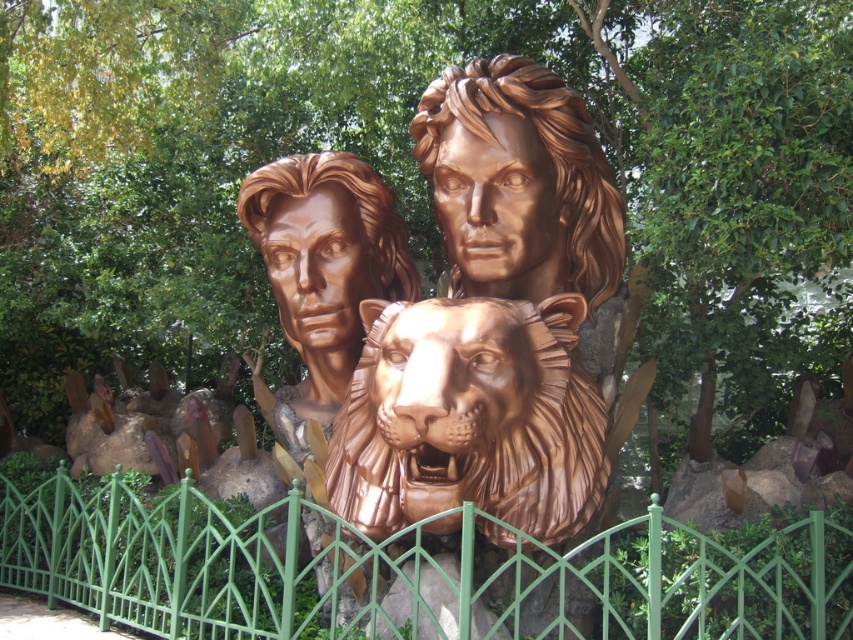
Does green leafy tree at upper center have a lesser width compared to green metal fence at center?

Correct, green leafy tree at upper center's width is less than green metal fence at center's.

The image size is (853, 640). What are the coordinates of `green leafy tree at upper center` in the screenshot? It's located at (410, 166).

Between bronze metallic lion head at center and bronze textured lion head at center, which one has more height?

Standing taller between the two is bronze metallic lion head at center.

Which is above, bronze metallic lion head at center or bronze textured lion head at center?

bronze metallic lion head at center is higher up.

Is point (467, 90) positioned before point (590, 502)?

That is False.

Where is `bronze metallic lion head at center`? This screenshot has height=640, width=853. bronze metallic lion head at center is located at coordinates (492, 323).

Is green leafy tree at upper center smaller than bronze textured lion head at center?

Indeed, green leafy tree at upper center has a smaller size compared to bronze textured lion head at center.

Does green leafy tree at upper center have a larger size compared to bronze textured lion head at center?

Actually, green leafy tree at upper center might be smaller than bronze textured lion head at center.

Measure the distance between green leafy tree at upper center and camera.

The distance of green leafy tree at upper center from camera is 5.69 meters.

Locate an element on the screen. This screenshot has height=640, width=853. green leafy tree at upper center is located at coordinates (410, 166).